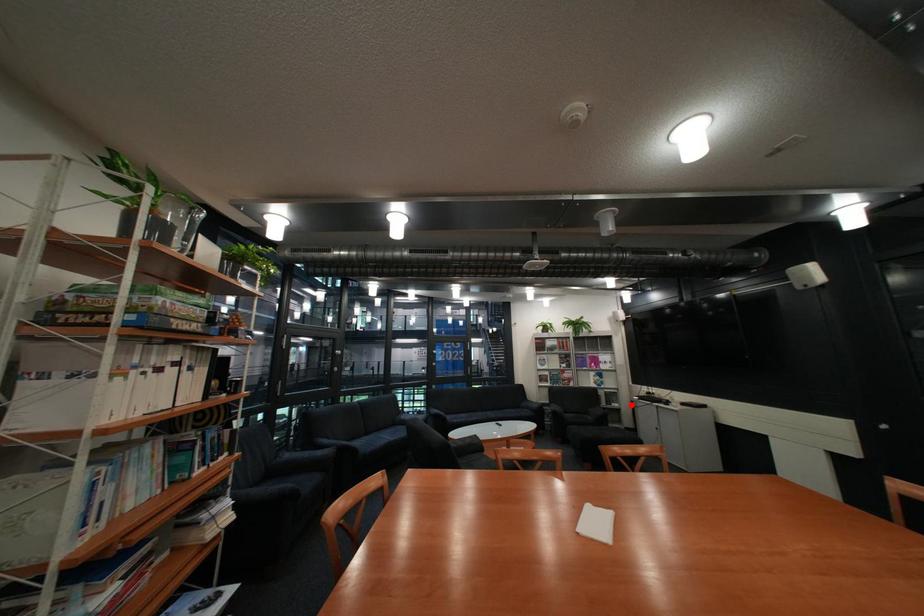
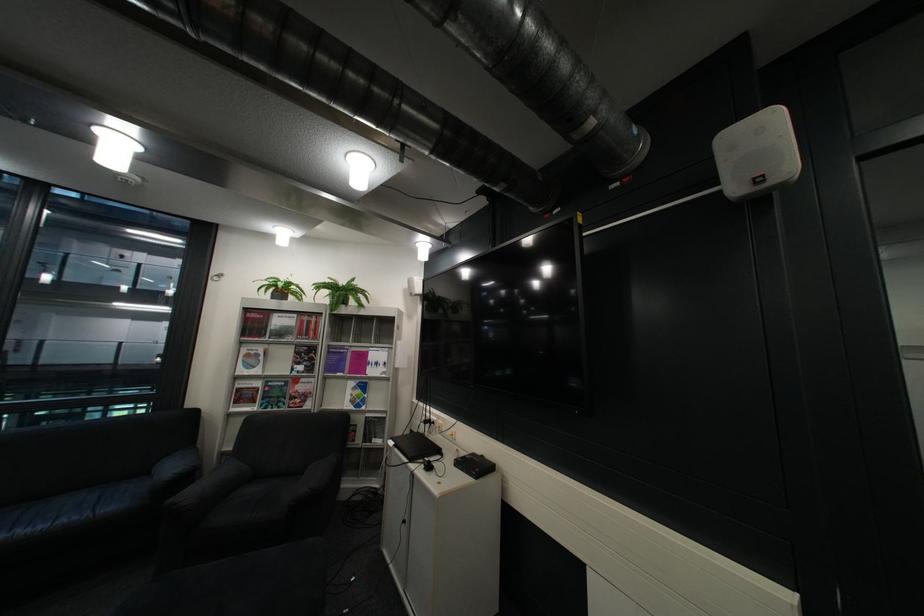
Locate, in the second image, the point that corresponds to the highlighted location in the first image.

(393, 442)